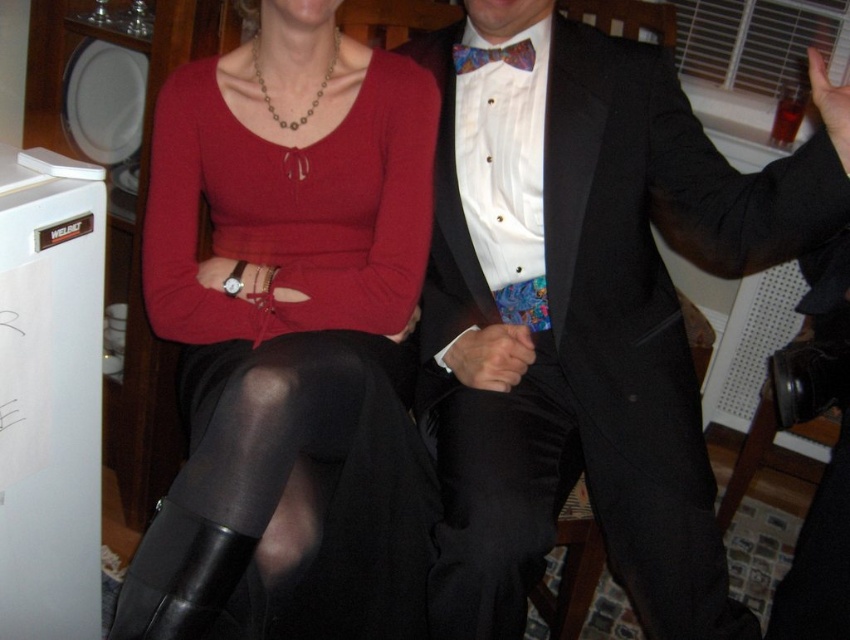
You are standing in the room and want to pick up the black sheer tights at lower center and the black satin pants at center. Which one do you need to bend down more to reach?

The black sheer tights at lower center is closer to the viewer than black satin pants at center, so you need to bend down more to reach the black satin pants at center.

You are a photographer setting up a shoot in this room. You need to position a small light source between the black satin pants at center and the multicolored silk bow tie at center. Can you place it directly in between them without moving any of the objects?

The black satin pants at center is in front of the multicolored silk bow tie at center, so you can place the light source between them by positioning it in front of the bow tie and behind the pants, as they are layered spatially.